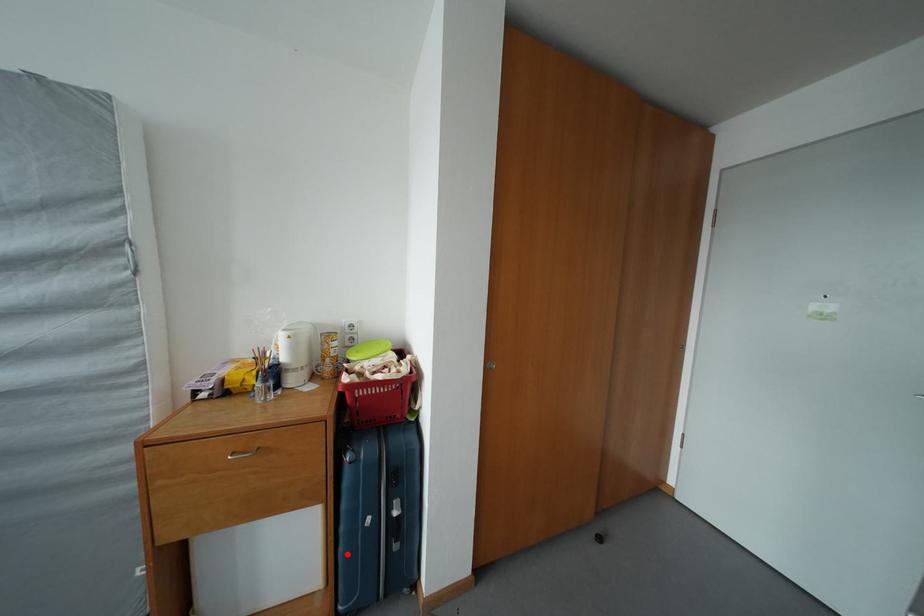
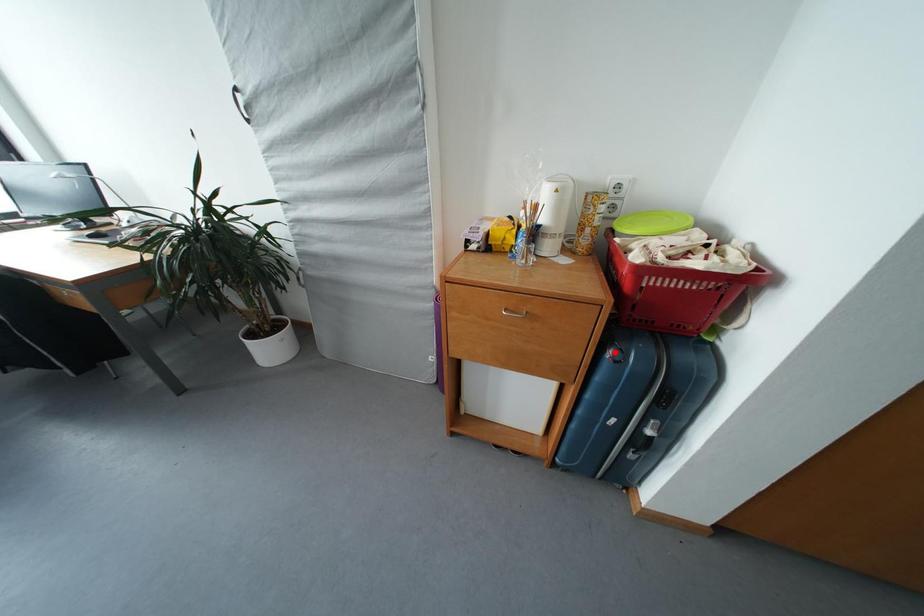
I am providing you with two images of the same scene from different viewpoints. A red point is marked on the first image and another point is marked on the second image. Are the points marked in image1 and image2 representing the same 3D position?

No